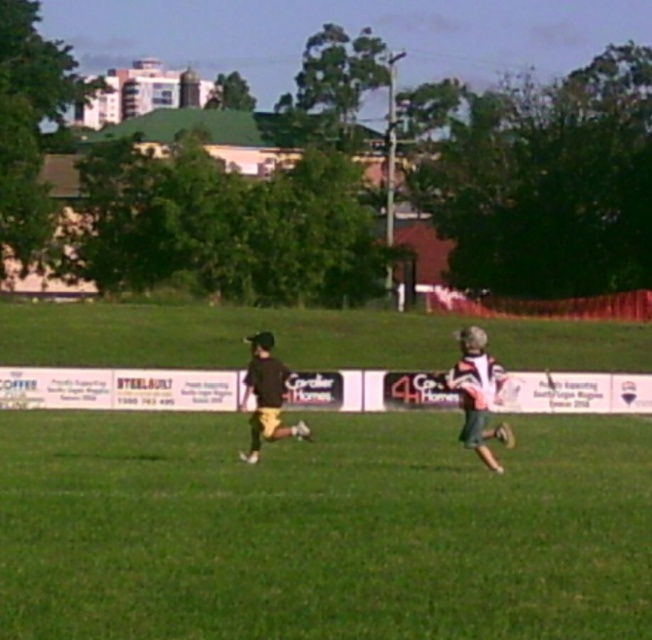
Question: Which point is closer to the camera taking this photo?

Choices:
 (A) (323, 509)
 (B) (484, 364)

Answer: (A)

Question: Which point is closer to the camera taking this photo?

Choices:
 (A) (303, 436)
 (B) (198, 612)
 (C) (469, 392)

Answer: (B)

Question: Is green grass at center to the right of striped jersey at right from the viewer's perspective?

Choices:
 (A) yes
 (B) no

Answer: (B)

Question: Is green grass at center closer to the viewer compared to dark brown jersey at center?

Choices:
 (A) yes
 (B) no

Answer: (A)

Question: Which object appears farthest from the camera in this image?

Choices:
 (A) striped jersey at right
 (B) green grass at center

Answer: (A)

Question: Is green grass at center to the right of striped jersey at right from the viewer's perspective?

Choices:
 (A) no
 (B) yes

Answer: (A)